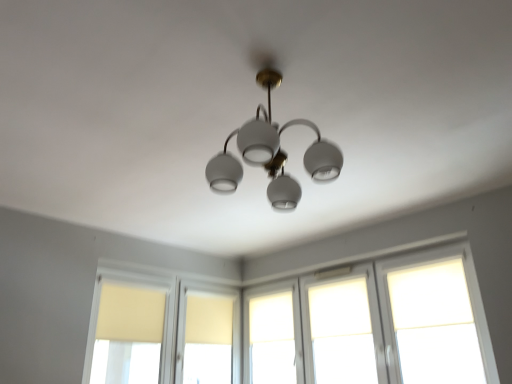
Question: Does matte yellow window at center, placed as the 5th window when sorted from right to left, have a larger size compared to matte yellow curtain at left, the first window from the left?

Choices:
 (A) yes
 (B) no

Answer: (B)

Question: Does matte yellow window at center, placed as the 5th window when sorted from right to left, have a smaller size compared to matte yellow curtain at left, the sixth window in the right-to-left sequence?

Choices:
 (A) yes
 (B) no

Answer: (A)

Question: Is matte yellow window at center, placed as the second window when sorted from left to right, wider than matte yellow curtain at left, the sixth window in the right-to-left sequence?

Choices:
 (A) no
 (B) yes

Answer: (A)

Question: Is the position of matte yellow window at center, placed as the 5th window when sorted from right to left, less distant than that of matte yellow curtain at left, the first window from the left?

Choices:
 (A) yes
 (B) no

Answer: (B)

Question: Can you confirm if matte yellow window at center, placed as the second window when sorted from left to right, is positioned to the right of matte yellow curtain at left, the sixth window in the right-to-left sequence?

Choices:
 (A) no
 (B) yes

Answer: (B)

Question: In the image, is white matte glass window at upper right, which ranks as the sixth window in left-to-right order, positioned in front of or behind white matte window at center, the 3th window from the right?

Choices:
 (A) front
 (B) behind

Answer: (B)

Question: Is white matte glass window at upper right, which is counted as the 1th window, starting from the right, wider or thinner than white matte window at center, the fourth window from the left?

Choices:
 (A) wide
 (B) thin

Answer: (B)

Question: In terms of height, does white matte glass window at upper right, which ranks as the sixth window in left-to-right order, look taller or shorter compared to white matte window at center, the 3th window from the right?

Choices:
 (A) tall
 (B) short

Answer: (B)

Question: From a real-world perspective, is white matte glass window at upper right, which ranks as the sixth window in left-to-right order, above or below white matte window at center, the 3th window from the right?

Choices:
 (A) below
 (B) above

Answer: (B)

Question: In terms of height, does beige fabric curtain at lower left look taller or shorter compared to matte yellow window at center, placed as the second window when sorted from left to right?

Choices:
 (A) tall
 (B) short

Answer: (A)

Question: Considering their positions, is beige fabric curtain at lower left located in front of or behind matte yellow window at center, placed as the 5th window when sorted from right to left?

Choices:
 (A) behind
 (B) front

Answer: (B)

Question: Is beige fabric curtain at lower left spatially inside matte yellow window at center, placed as the second window when sorted from left to right, or outside of it?

Choices:
 (A) inside
 (B) outside

Answer: (B)

Question: Considering the positions of beige fabric curtain at lower left and matte yellow window at center, placed as the second window when sorted from left to right, in the image, is beige fabric curtain at lower left wider or thinner than matte yellow window at center, placed as the second window when sorted from left to right,?

Choices:
 (A) thin
 (B) wide

Answer: (B)

Question: From a real-world perspective, is matte yellow curtain at left, the sixth window in the right-to-left sequence, physically located above or below beige fabric curtain at lower left?

Choices:
 (A) below
 (B) above

Answer: (A)

Question: Does point (113, 321) appear closer or farther from the camera than point (132, 316)?

Choices:
 (A) farther
 (B) closer

Answer: (B)